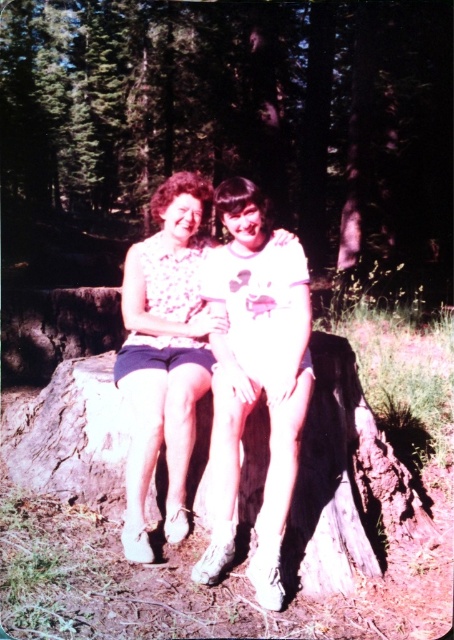
Question: Among these objects, which one is nearest to the camera?

Choices:
 (A) brown rough tree stump at center
 (B) floral fabric dress at center
 (C) floral fabric blouse at center

Answer: (B)

Question: Which object appears closest to the camera in this image?

Choices:
 (A) brown rough tree stump at center
 (B) floral fabric blouse at center

Answer: (B)

Question: Observing the image, what is the correct spatial positioning of floral fabric dress at center in reference to floral fabric blouse at center?

Choices:
 (A) above
 (B) below

Answer: (B)

Question: Is floral fabric dress at center thinner than floral fabric blouse at center?

Choices:
 (A) no
 (B) yes

Answer: (A)

Question: Is brown rough tree stump at center to the right of floral fabric dress at center from the viewer's perspective?

Choices:
 (A) no
 (B) yes

Answer: (A)

Question: Among these objects, which one is farthest from the camera?

Choices:
 (A) floral fabric dress at center
 (B) brown rough tree stump at center

Answer: (B)